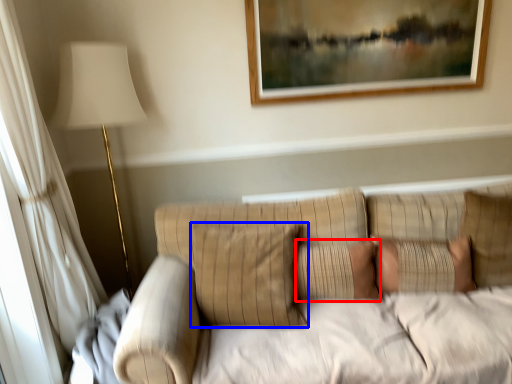
Question: Which point is further to the camera, pillow (highlighted by a red box) or pillow (highlighted by a blue box)?

Choices:
 (A) pillow
 (B) pillow

Answer: (A)